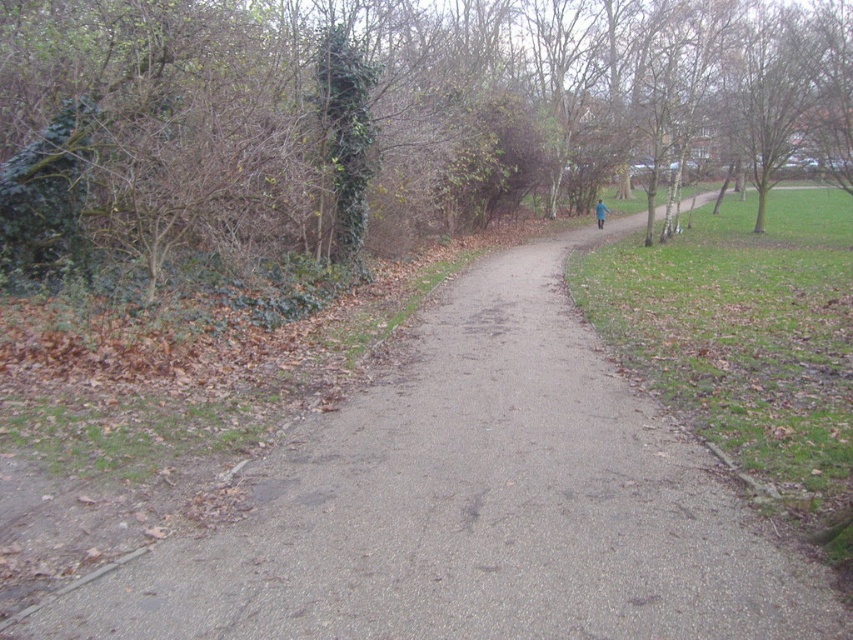
You are standing at the start of the gray asphalt trail at center and want to reach the blue fabric jacket at upper center. Based on their sizes, which object is smaller and might require closer inspection to see details?

The gray asphalt trail at center is shorter than the blue fabric jacket at upper center, so the trail is smaller in size and might require closer inspection to see details.